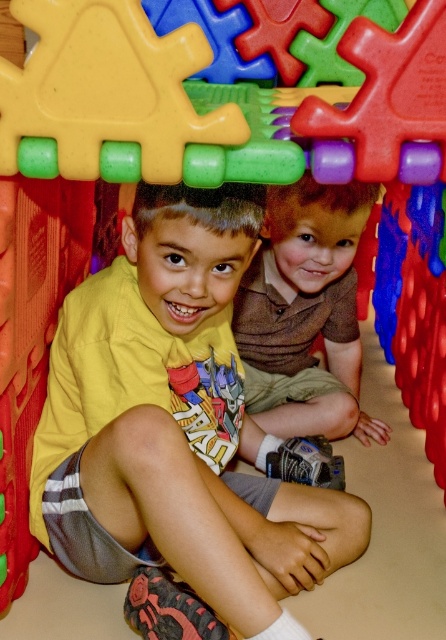
Between yellow cotton shirt at center and brown textured shirt at center, which one appears on the right side from the viewer's perspective?

brown textured shirt at center

You are a GUI agent. You are given a task and a screenshot of the screen. Output one action in this format:
    pyautogui.click(x=<x>, y=<y>)
    Task: Click on the yellow cotton shirt at center
    Image resolution: width=446 pixels, height=640 pixels.
    Given the screenshot: What is the action you would take?
    pyautogui.click(x=177, y=426)